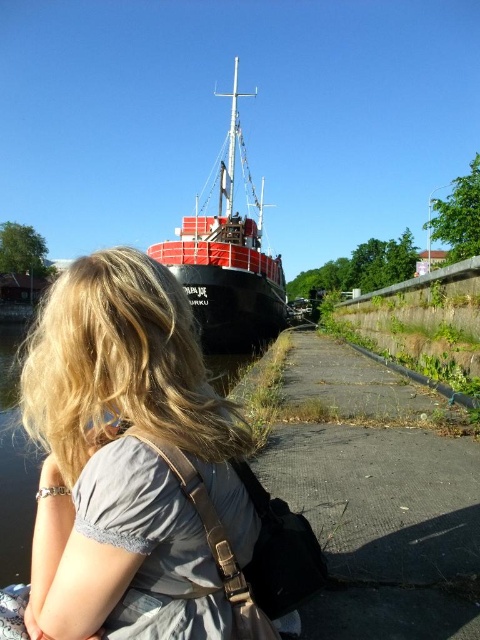
Question: Does blonde hair at center appear on the right side of red matte ship at center?

Choices:
 (A) no
 (B) yes

Answer: (A)

Question: Which of the following is the farthest from the observer?

Choices:
 (A) red matte ship at center
 (B) blonde hair at center

Answer: (A)

Question: Considering the relative positions of blonde hair at center and red matte ship at center in the image provided, where is blonde hair at center located with respect to red matte ship at center?

Choices:
 (A) below
 (B) above

Answer: (A)

Question: Is the position of blonde hair at center less distant than that of red matte ship at center?

Choices:
 (A) no
 (B) yes

Answer: (B)